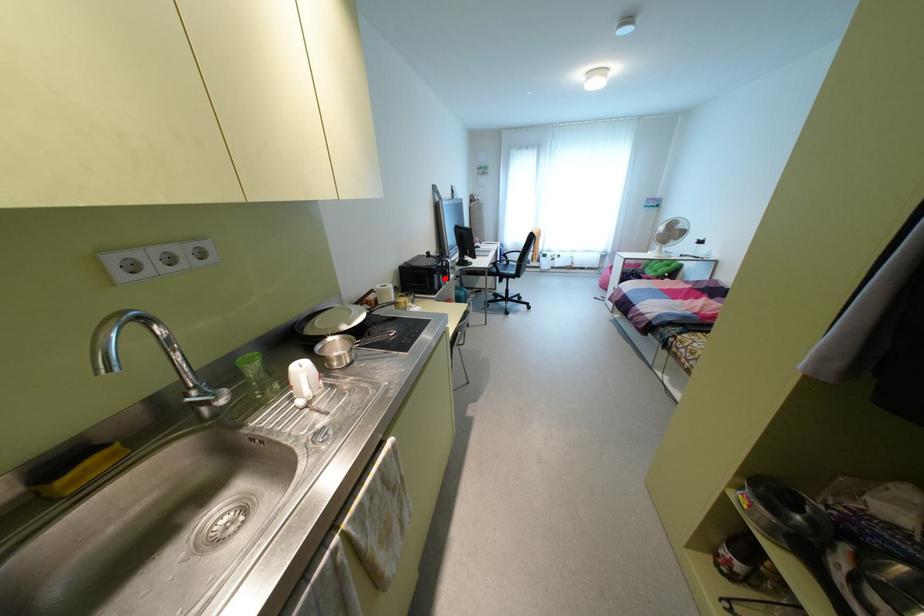
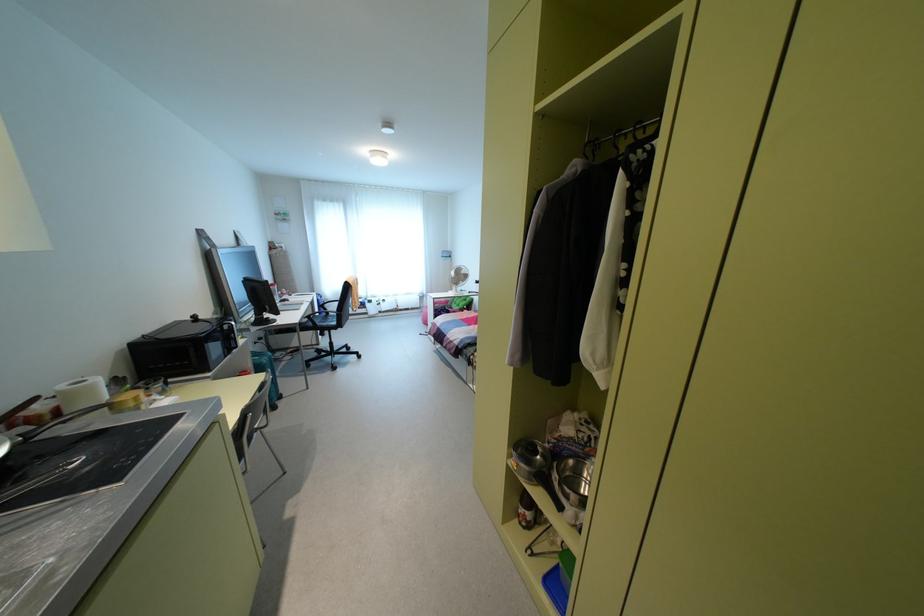
Question: I am providing you with two images of the same scene from different viewpoints. A red point is shown in image1. For the corresponding object point in image2, is it positioned nearer or farther from the camera?

Choices:
 (A) Nearer
 (B) Farther

Answer: (A)